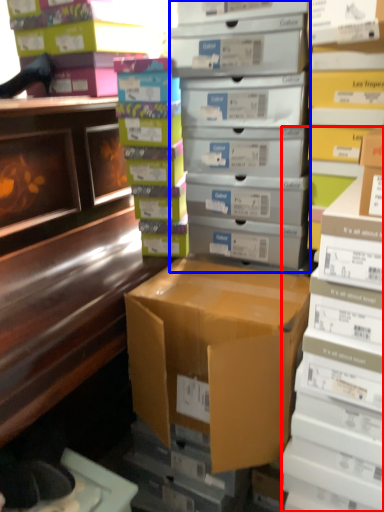
Question: Which object appears farthest to the camera in this image, book (highlighted by a red box) or shelf (highlighted by a blue box)?

Choices:
 (A) book
 (B) shelf

Answer: (B)